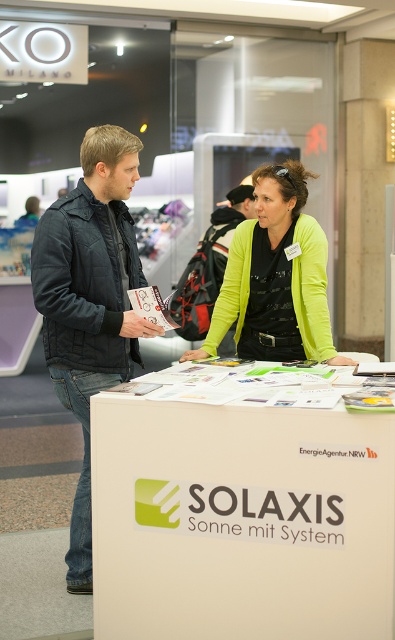
Question: Is lime green sweater at center above matte black jacket at left?

Choices:
 (A) no
 (B) yes

Answer: (B)

Question: Among these objects, which one is farthest from the camera?

Choices:
 (A) white cardboard sign at center
 (B) matte black jacket at left
 (C) dark blue quilted jacket at left
 (D) lime green sweater at center

Answer: (D)

Question: Can you confirm if white cardboard sign at center is thinner than matte black jacket at left?

Choices:
 (A) no
 (B) yes

Answer: (A)

Question: Among these objects, which one is nearest to the camera?

Choices:
 (A) dark blue quilted jacket at left
 (B) lime green sweater at center

Answer: (A)

Question: Is dark blue quilted jacket at left closer to the viewer compared to matte black jacket at left?

Choices:
 (A) yes
 (B) no

Answer: (A)

Question: Which object is positioned farthest from the matte black jacket at left?

Choices:
 (A) lime green sweater at center
 (B) white cardboard sign at center
 (C) dark blue quilted jacket at left

Answer: (B)